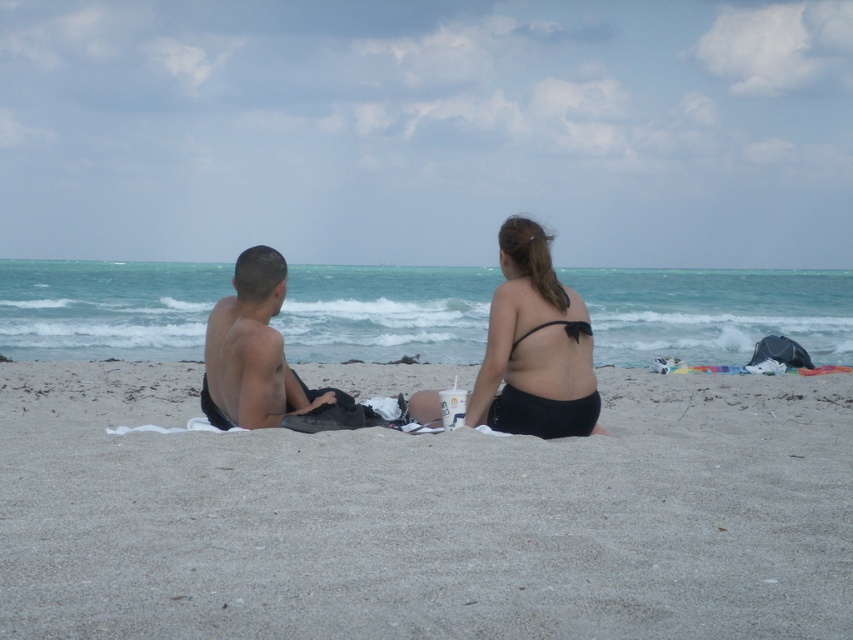
Question: Which of the following is the farthest from the observer?

Choices:
 (A) (541, 349)
 (B) (572, 337)

Answer: (B)

Question: Among these points, which one is farthest from the camera?

Choices:
 (A) (508, 291)
 (B) (587, 358)

Answer: (B)

Question: Which object is positioned farthest from the matte black towel at left?

Choices:
 (A) smooth sand at center
 (B) matte black bikini at center

Answer: (A)

Question: Is matte black bikini at center closer to camera compared to matte black towel at left?

Choices:
 (A) no
 (B) yes

Answer: (A)

Question: Can you confirm if matte black towel at left is positioned to the right of black matte bikini top at center?

Choices:
 (A) yes
 (B) no

Answer: (B)

Question: From the image, what is the correct spatial relationship of smooth sand at center in relation to matte black bikini at center?

Choices:
 (A) right
 (B) left

Answer: (B)